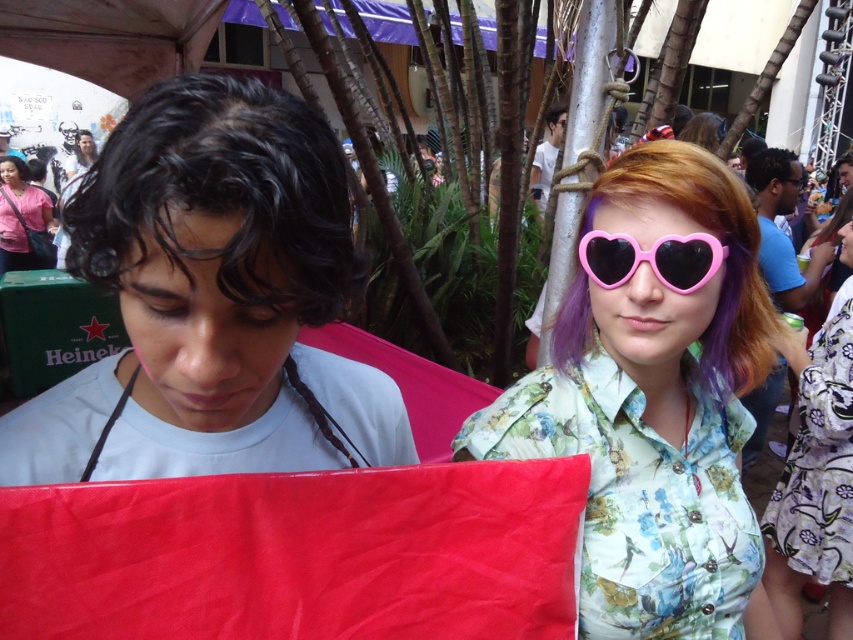
Between black shiny hair at upper right and smooth skin face at upper left, which one appears on the right side from the viewer's perspective?

black shiny hair at upper right is more to the right.

Which is above, black shiny hair at upper right or smooth skin face at upper left?

smooth skin face at upper left is above.

What do you see at coordinates (769, 168) in the screenshot?
I see `black shiny hair at upper right` at bounding box center [769, 168].

I want to click on black shiny hair at upper right, so click(x=769, y=168).

Is blue fabric at right above black shiny hair at upper right?

Incorrect, blue fabric at right is not positioned above black shiny hair at upper right.

Based on the photo, does blue fabric at right have a smaller size compared to black shiny hair at upper right?

Actually, blue fabric at right might be larger than black shiny hair at upper right.

At what (x,y) coordinates should I click in order to perform the action: click on blue fabric at right. Please return your answer as a coordinate pair (x, y). Image resolution: width=853 pixels, height=640 pixels. Looking at the image, I should click on (782, 230).

Image resolution: width=853 pixels, height=640 pixels. What are the coordinates of `blue fabric at right` in the screenshot? It's located at (782, 230).

Identify the location of blue fabric at right. (782, 230).